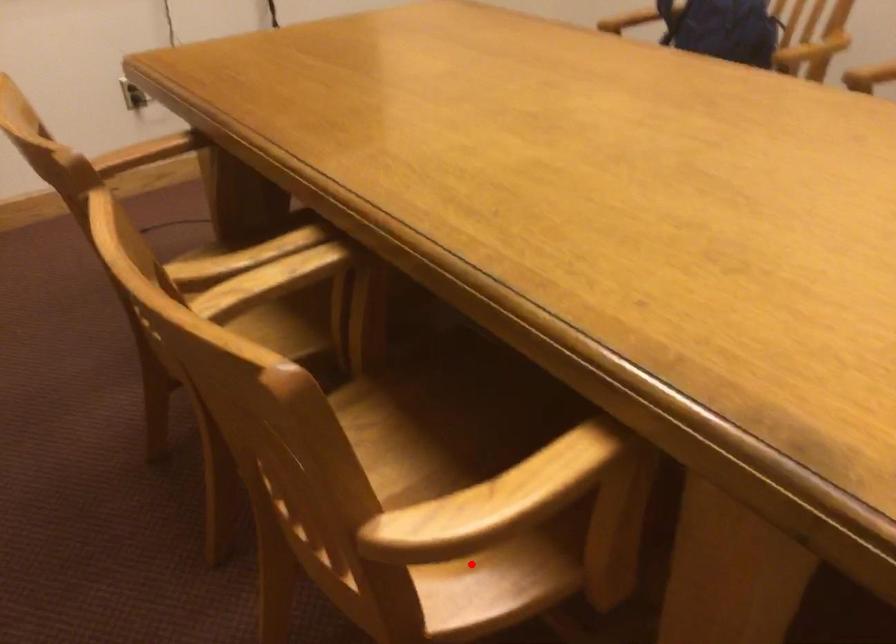
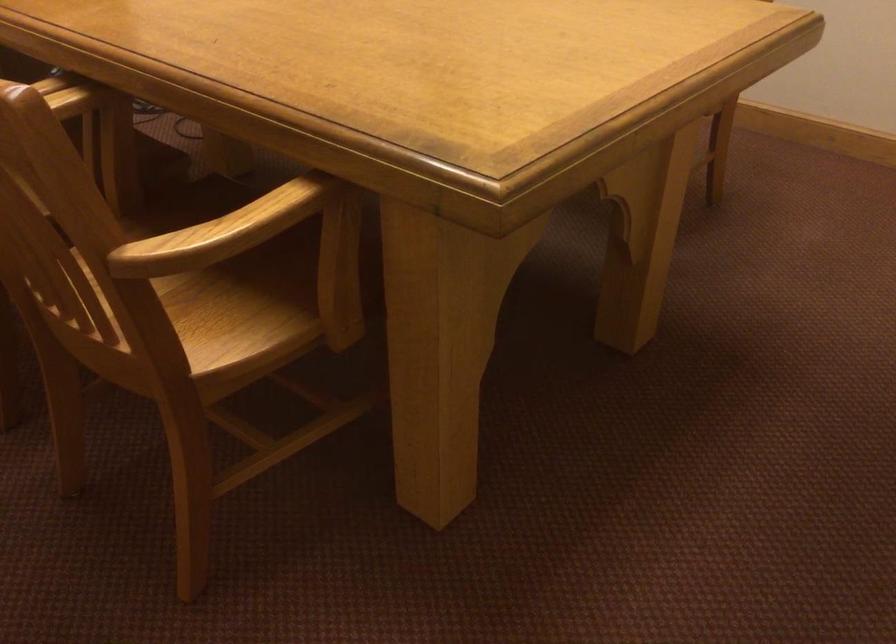
In the second image, find the point that corresponds to the highlighted location in the first image.

(227, 327)